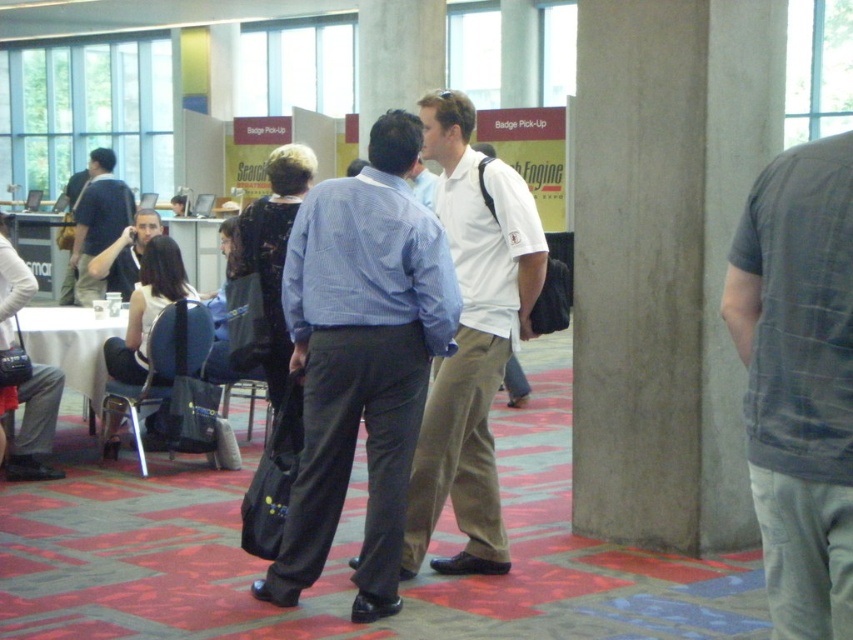
Question: Which object is closer to the camera taking this photo?

Choices:
 (A) blue checkered shirt at center
 (B) concrete pillar at center
 (C) gray plaid shirt at center
 (D) dark blue shirt at center

Answer: (C)

Question: Does gray plaid shirt at center have a larger size compared to white cotton shirt at center?

Choices:
 (A) no
 (B) yes

Answer: (A)

Question: Is white cotton shirt at center below matte black shirt at left?

Choices:
 (A) no
 (B) yes

Answer: (B)

Question: Which is farther from the matte black shirt at left?

Choices:
 (A) concrete pillar at center
 (B) gray plaid shirt at center
 (C) white cotton shirt at center
 (D) blue checkered shirt at center

Answer: (B)

Question: Does concrete pillar at center lie behind blue checkered shirt at center?

Choices:
 (A) yes
 (B) no

Answer: (A)

Question: Which point is farther to the camera?

Choices:
 (A) (708, 140)
 (B) (825, 289)
 (C) (366, 609)
 (D) (103, 285)

Answer: (D)